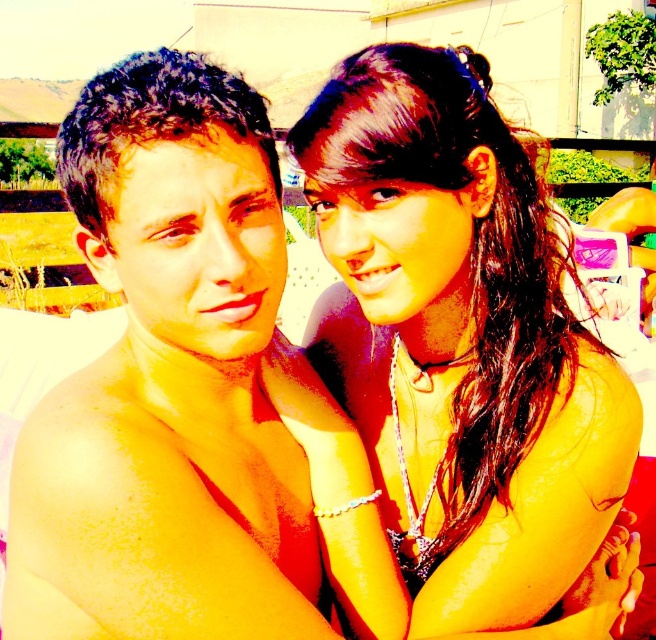
You are a photographer adjusting the lighting for a photo shoot. The subjects are the man and woman in the scene. You need to ensure that the satin black bikini top at upper right and the shiny skin at left are evenly lit. Given their current distance apart, can you estimate if the lighting equipment can cover both areas simultaneously?

The satin black bikini top at upper right and shiny skin at left are 32.89 centimeters apart. Since most professional lighting equipment has a coverage range of at least 1 meter, the distance between them is well within the equipment capabilities. Therefore, the lighting equipment can effectively cover both areas simultaneously.

You are a photographer trying to capture the perfect shot of the two people in the scene. You notice the satin black bikini top at upper right and the shiny skin at left. Which object should you focus on if you want to highlight something larger in size?

The satin black bikini top at upper right has a larger size compared to the shiny skin at left, so focusing on the satin black bikini top at upper right would highlight the larger object.